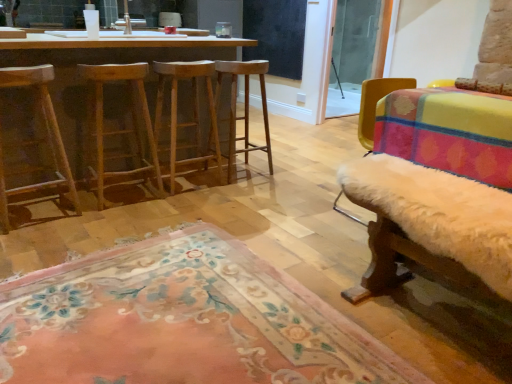
Question: Does point (271, 57) appear closer or farther from the camera than point (355, 9)?

Choices:
 (A) closer
 (B) farther

Answer: (B)

Question: From the image's perspective, relative to transparent glass screen door at upper right, is black matte window screen at upper center above or below?

Choices:
 (A) below
 (B) above

Answer: (B)

Question: Which of these objects is positioned farthest from the wooden stool at center, marked as the first stool in a right-to-left arrangement?

Choices:
 (A) light brown wood stool at center, the second stool positioned from the left
 (B) black matte window screen at upper center
 (C) wooden barstools at left
 (D) floral rug at lower center
 (E) natural wood stool at center, placed as the 3th stool when sorted from right to left

Answer: (B)

Question: Which object is positioned closest to the black matte window screen at upper center?

Choices:
 (A) wooden stool at center, marked as the first stool in a right-to-left arrangement
 (B) floral rug at lower center
 (C) natural wood stool at center, placed as the 3th stool when sorted from right to left
 (D) transparent glass screen door at upper right
 (E) wooden stool at left

Answer: (D)